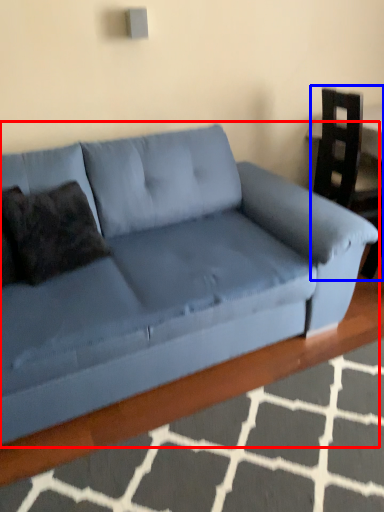
Question: Which point is further to the camera, studio couch (highlighted by a red box) or armchair (highlighted by a blue box)?

Choices:
 (A) studio couch
 (B) armchair

Answer: (B)